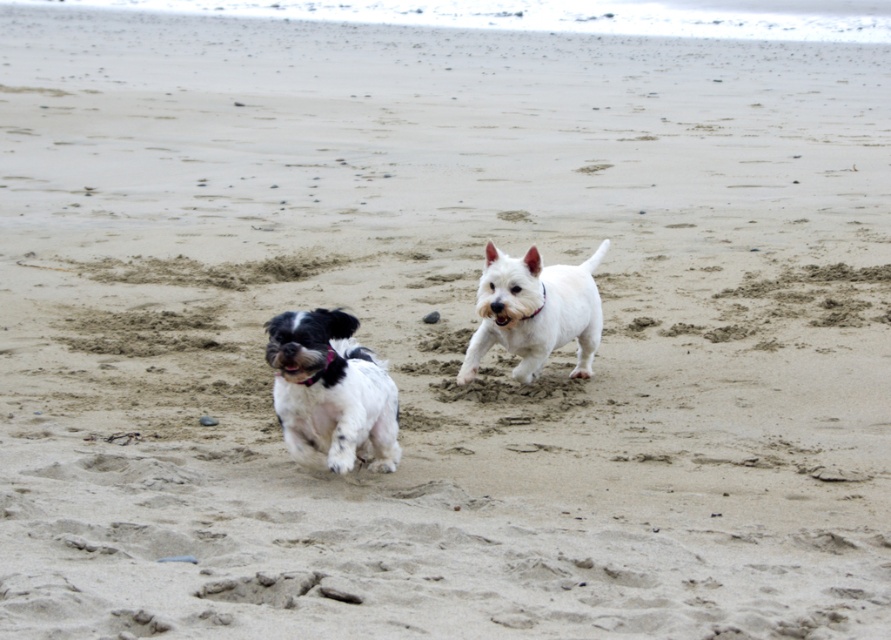
Consider the image. Can you confirm if black and white fur dog at left is positioned above white smooth dog at center?

Incorrect, black and white fur dog at left is not positioned above white smooth dog at center.

Looking at this image, can you confirm if black and white fur dog at left is smaller than white smooth dog at center?

Yes.

Locate an element on the screen. This screenshot has width=891, height=640. black and white fur dog at left is located at coordinates (331, 392).